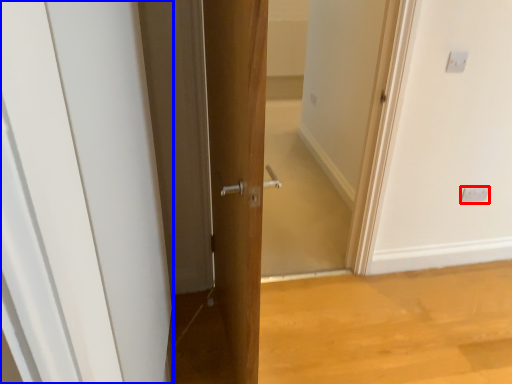
Question: Which object is closer to the camera taking this photo, electric outlet (highlighted by a red box) or door (highlighted by a blue box)?

Choices:
 (A) electric outlet
 (B) door

Answer: (B)